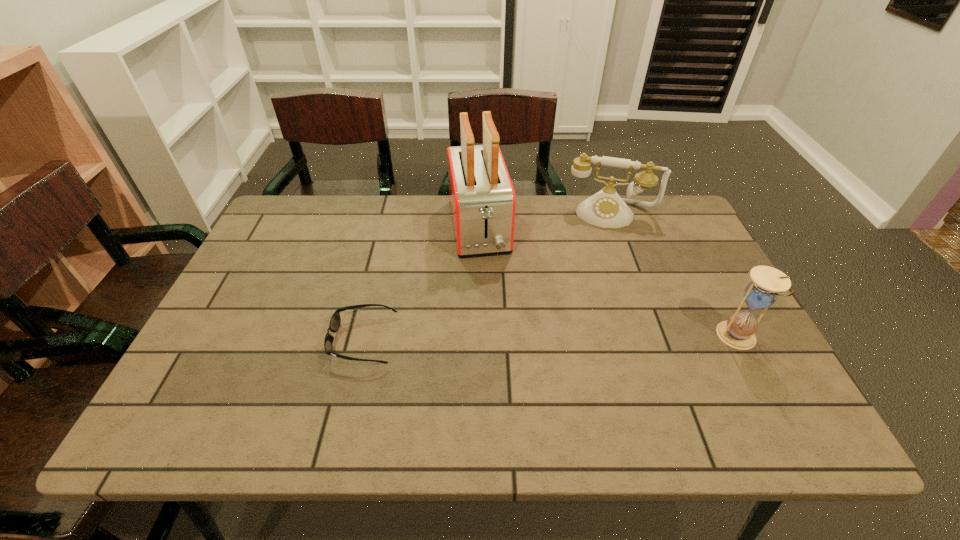
Find the location of a particular element. Image resolution: width=960 pixels, height=540 pixels. free space on the desktop that is between the shortest object and the hourglass and is positioned on the dial of the second object from right to left is located at coordinates (598, 339).

At what (x,y) coordinates should I click in order to perform the action: click on vacant space on the desktop that is between the leftmost object and the hourglass and is positioned on the front-facing side of the tallest object. Please return your answer as a coordinate pair (x, y). Looking at the image, I should click on (503, 339).